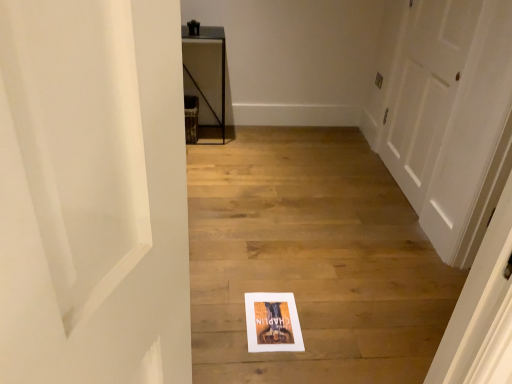
Where is `empty space that is ontop of matte paper picture frame at center`? This screenshot has width=512, height=384. empty space that is ontop of matte paper picture frame at center is located at coordinates (268, 315).